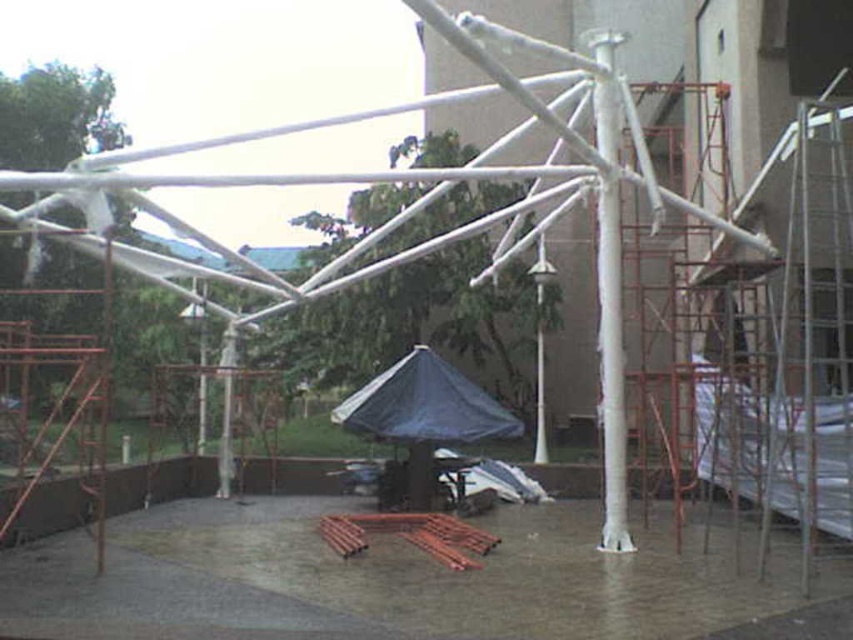
Which is behind, point (610, 257) or point (332, 416)?

The point (332, 416) is behind.

Where is `white plastic pole at center`? The height and width of the screenshot is (640, 853). white plastic pole at center is located at coordinates (608, 292).